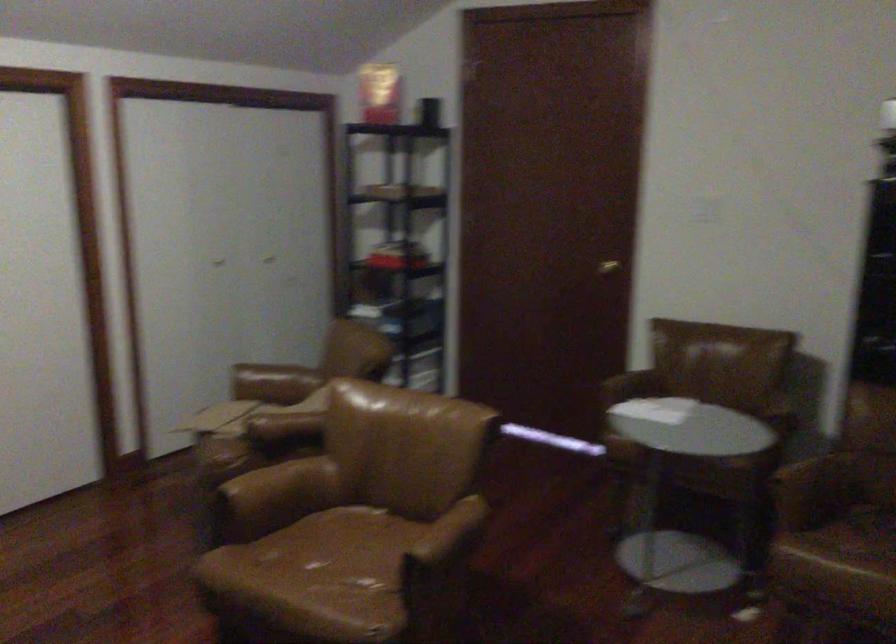
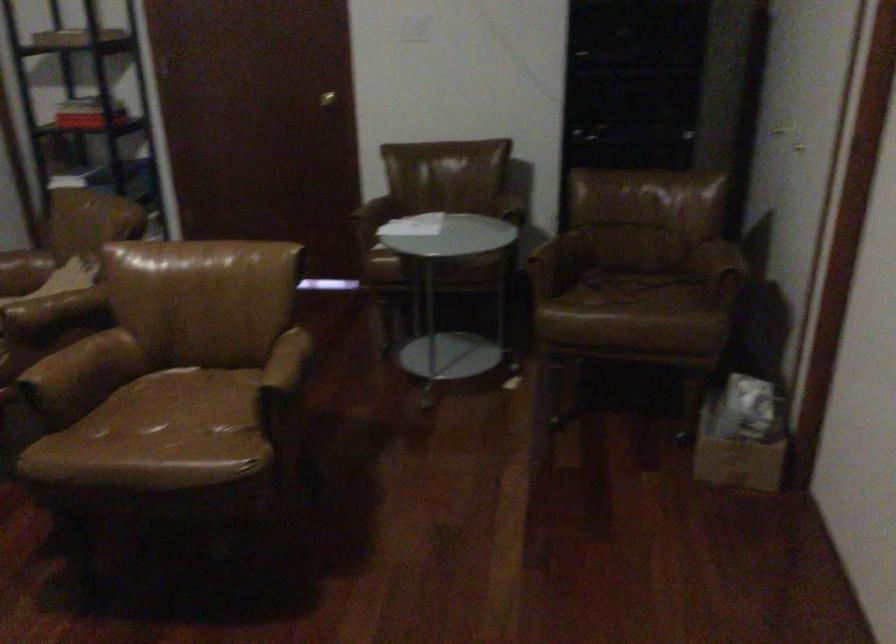
Question: The images are taken continuously from a first-person perspective. In which direction is your viewpoint rotating?

Choices:
 (A) Left
 (B) Right
 (C) Up
 (D) Down

Answer: (B)